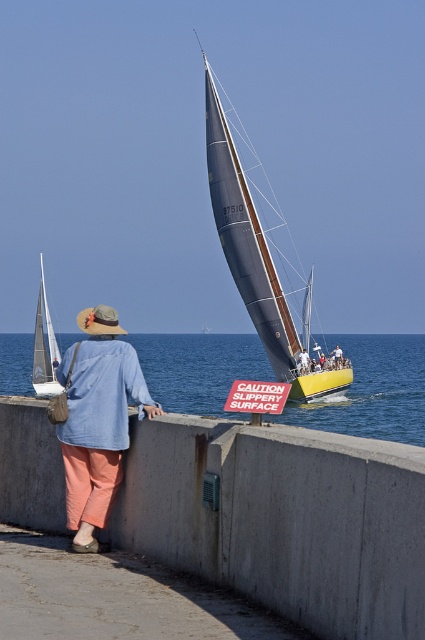
Is concrete at center to the right of white glossy sailboat at left from the viewer's perspective?

Correct, you'll find concrete at center to the right of white glossy sailboat at left.

Between point (224, 488) and point (59, 387), which one is positioned in front?

Positioned in front is point (224, 488).

Measure the distance between concrete at center and camera.

concrete at center is 20.51 feet away from camera.

Where is `concrete at center`? concrete at center is located at coordinates (283, 518).

Does denim shirt at center have a greater height compared to white fabric shirt at center?

Yes, denim shirt at center is taller than white fabric shirt at center.

Does point (124, 420) come behind point (305, 364)?

No, it is in front of (305, 364).

The height and width of the screenshot is (640, 425). What do you see at coordinates (98, 419) in the screenshot?
I see `denim shirt at center` at bounding box center [98, 419].

Find the location of a particular element. denim shirt at center is located at coordinates (98, 419).

In the scene shown: Is white glossy sailboat at left below white fabric shirt at center?

No.

Which is above, white glossy sailboat at left or white fabric shirt at center?

white glossy sailboat at left

The image size is (425, 640). Describe the element at coordinates (45, 348) in the screenshot. I see `white glossy sailboat at left` at that location.

Where is `white glossy sailboat at left`? Image resolution: width=425 pixels, height=640 pixels. white glossy sailboat at left is located at coordinates (45, 348).